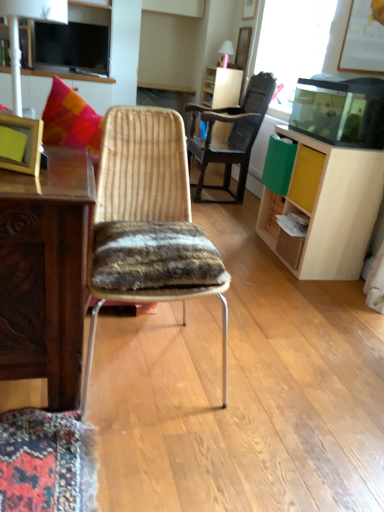
Locate an element on the screen. Image resolution: width=384 pixels, height=512 pixels. vacant space that is to the left of light wood cabinet at right is located at coordinates (239, 242).